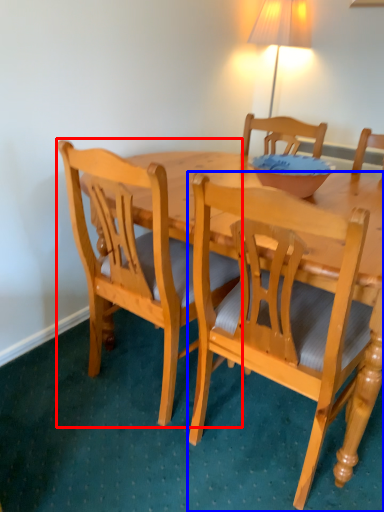
Question: Among these objects, which one is nearest to the camera, chair (highlighted by a red box) or chair (highlighted by a blue box)?

Choices:
 (A) chair
 (B) chair

Answer: (B)